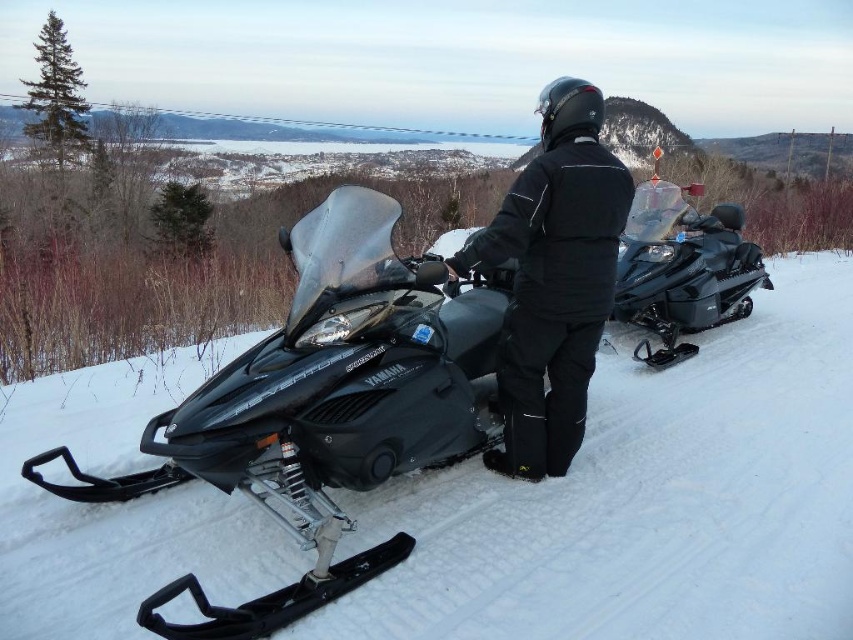
Question: Is matte black snowmobile at center to the left of shiny black snowmobile at right from the viewer's perspective?

Choices:
 (A) no
 (B) yes

Answer: (B)

Question: Which is farther from the shiny black snowmobile at right?

Choices:
 (A) matte black snowmobile at center
 (B) black matte jacket at center

Answer: (A)

Question: From the image, what is the correct spatial relationship of matte black snowmobile at center in relation to black matte jacket at center?

Choices:
 (A) below
 (B) above

Answer: (A)

Question: Which point is closer to the camera?

Choices:
 (A) shiny black snowmobile at right
 (B) matte black snowmobile at center
 (C) black matte jacket at center

Answer: (B)

Question: Which of these objects is positioned farthest from the black matte jacket at center?

Choices:
 (A) matte black snowmobile at center
 (B) shiny black snowmobile at right

Answer: (B)

Question: Is matte black snowmobile at center to the left of black matte jacket at center from the viewer's perspective?

Choices:
 (A) no
 (B) yes

Answer: (B)